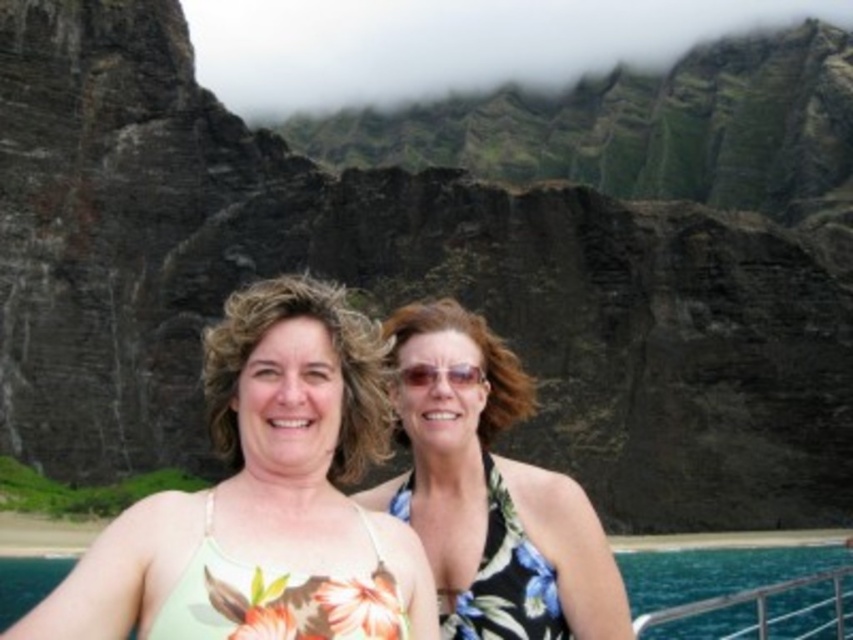
You are a photographer trying to capture a wide shot of the two people in the image. The floral print bikini top at center and the green floral swimsuit at lower center are both in your frame. Based on their sizes, which one would you need to zoom in more to focus on?

The floral print bikini top at center has a smaller width than the green floral swimsuit at lower center, so you would need to zoom in more to focus on the floral print bikini top at center to ensure it is clearly visible in the photo.

You are a photographer trying to capture both the floral print bikini top at center and the green floral swimsuit at lower center in a single shot. Which one should you focus on first to ensure both are in clear view?

The floral print bikini top at center is closer to the viewer than the green floral swimsuit at lower center, so focusing on the closer one first will help ensure both are in clear view.

You are a photographer trying to capture a clear shot of both the green floral swimsuit at center and the floral print bikini top at center. Based on their positions, which one might be partially obscured in the photo?

The floral print bikini top at center might be partially obscured because the green floral swimsuit at center is in front of it.